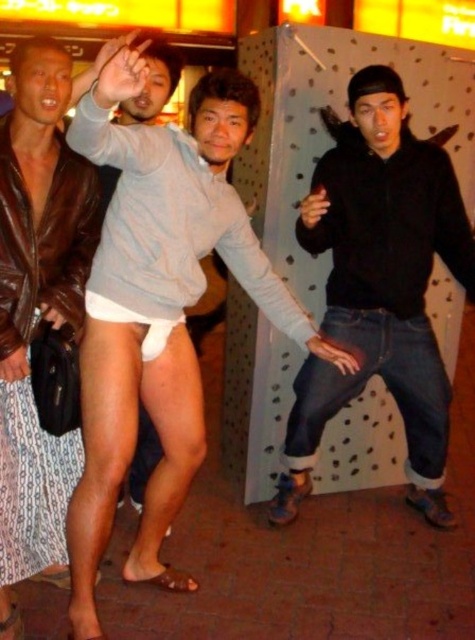
You are a photographer adjusting the camera focus. You need to ensure both the white matte underwear at center and the white fabric underwear at center are in focus. Which one requires adjusting the focus to a closer distance?

The white matte underwear at center is wider than the white fabric underwear at center, so it might be closer to the camera. Adjust the focus to a closer distance for the white matte underwear at center.

You are a photographer adjusting the focus on your camera. You need to ensure that both the white matte underwear at center and the white fabric underwear at center are in focus. Which underwear should you focus on first to ensure the other is also in focus?

You should focus on the white matte underwear at center first because it is taller than the white fabric underwear at center, so focusing on the taller one will help ensure the shorter one is also in focus.